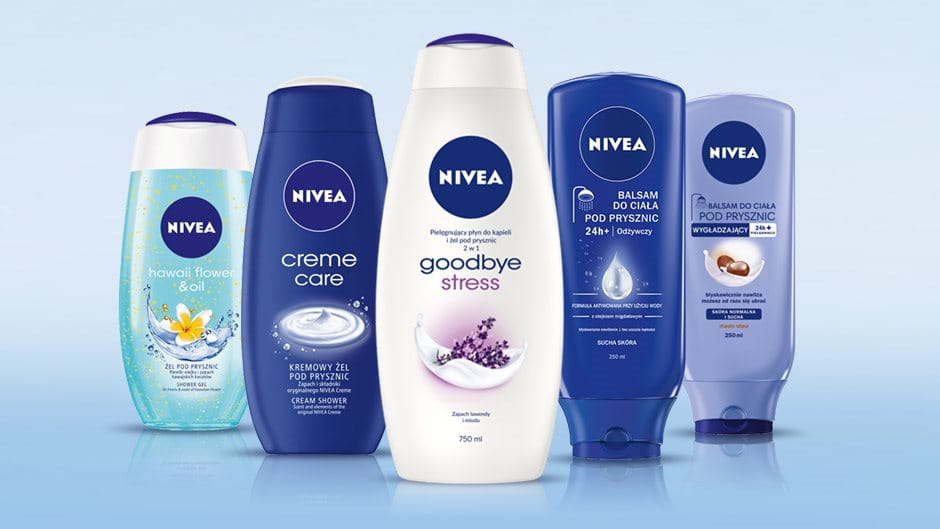
The height and width of the screenshot is (529, 940). What are the coordinates of `personal care products` in the screenshot? It's located at (637, 363), (737, 338), (526, 290), (290, 270), (134, 290).